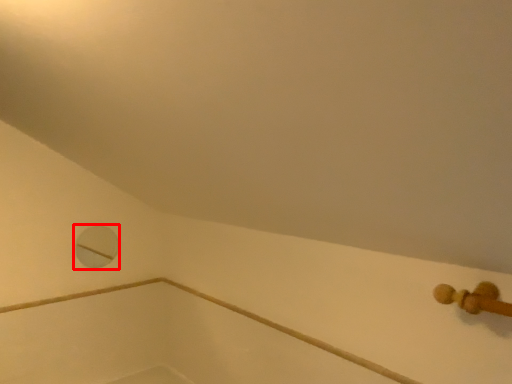
Question: Considering the relative positions of hole (annotated by the red box) and bath in the image provided, where is hole (annotated by the red box) located with respect to the staircase?

Choices:
 (A) right
 (B) left

Answer: (B)